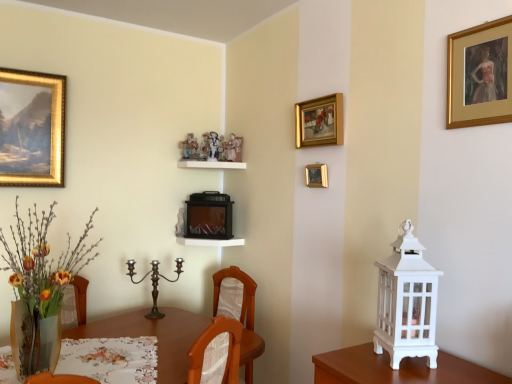
Question: Can you confirm if polished bronze candle holder at center, positioned as the 1th candle holder in back-to-front order, is shorter than floral lace tablecloth at lower left?

Choices:
 (A) yes
 (B) no

Answer: (B)

Question: From the image's perspective, is polished bronze candle holder at center, positioned as the 1th candle holder in back-to-front order, located beneath floral lace tablecloth at lower left?

Choices:
 (A) no
 (B) yes

Answer: (A)

Question: Does polished bronze candle holder at center, positioned as the 1th candle holder in back-to-front order, have a greater width compared to floral lace tablecloth at lower left?

Choices:
 (A) yes
 (B) no

Answer: (B)

Question: Considering the relative positions of polished bronze candle holder at center, marked as the second candle holder in a right-to-left arrangement, and floral lace tablecloth at lower left in the image provided, is polished bronze candle holder at center, marked as the second candle holder in a right-to-left arrangement, in front of floral lace tablecloth at lower left?

Choices:
 (A) no
 (B) yes

Answer: (A)

Question: Are polished bronze candle holder at center, positioned as the 1th candle holder in back-to-front order, and floral lace tablecloth at lower left far apart?

Choices:
 (A) yes
 (B) no

Answer: (B)

Question: From the image's perspective, is gold-framed painting at upper center, placed as the 2th picture frame when sorted from front to back, above or below white glossy shelf at center, arranged as the first shelf when ordered from the bottom?

Choices:
 (A) above
 (B) below

Answer: (A)

Question: In the image, is gold-framed painting at upper center, which appears as the second picture frame when viewed from the right, positioned in front of or behind white glossy shelf at center, the second shelf viewed from the top?

Choices:
 (A) front
 (B) behind

Answer: (A)

Question: Is gold-framed painting at upper center, the second picture frame positioned from the left, wider or thinner than white glossy shelf at center, arranged as the first shelf when ordered from the bottom?

Choices:
 (A) wide
 (B) thin

Answer: (B)

Question: Looking at the image, does gold-framed painting at upper center, the second picture frame positioned from the left, seem bigger or smaller compared to white glossy shelf at center, arranged as the first shelf when ordered from the bottom?

Choices:
 (A) small
 (B) big

Answer: (A)

Question: Is brown wooden table at center inside or outside of white glossy shelf at upper center, marked as the 2th shelf in a bottom-to-top arrangement?

Choices:
 (A) outside
 (B) inside

Answer: (A)

Question: Is brown wooden table at center taller or shorter than white glossy shelf at upper center, which appears as the first shelf when viewed from the top?

Choices:
 (A) short
 (B) tall

Answer: (B)

Question: From the image's perspective, is brown wooden table at center above or below white glossy shelf at upper center, which appears as the first shelf when viewed from the top?

Choices:
 (A) below
 (B) above

Answer: (A)

Question: Considering the relative positions of brown wooden table at center and white glossy shelf at upper center, which appears as the first shelf when viewed from the top, in the image provided, is brown wooden table at center to the left or to the right of white glossy shelf at upper center, which appears as the first shelf when viewed from the top,?

Choices:
 (A) left
 (B) right

Answer: (A)

Question: Is gold-framed painting at upper center, placed as the 2th picture frame when sorted from front to back, to the left or to the right of translucent glass vase at lower left in the image?

Choices:
 (A) left
 (B) right

Answer: (B)

Question: In the image, is gold-framed painting at upper center, which is the second picture frame from back to front, positioned in front of or behind translucent glass vase at lower left?

Choices:
 (A) front
 (B) behind

Answer: (B)